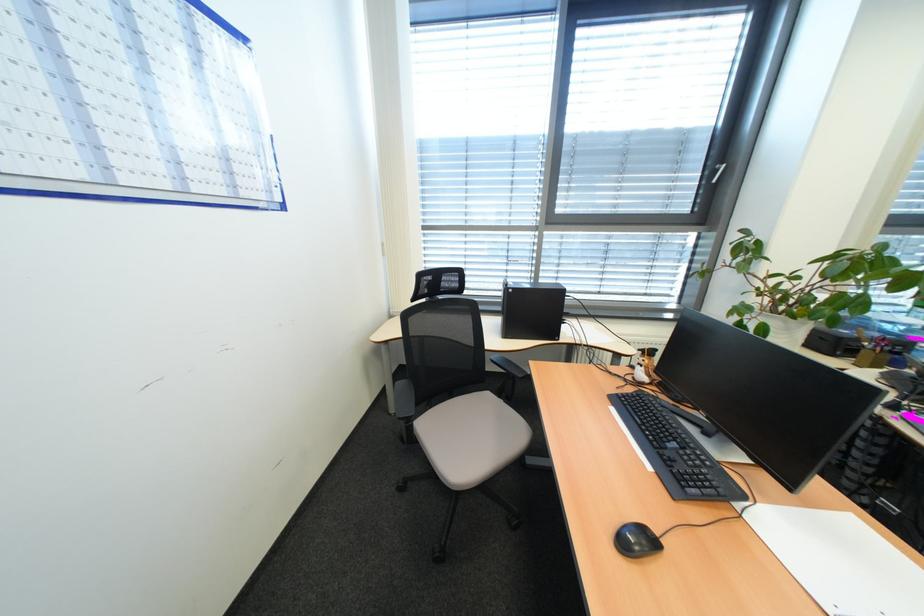
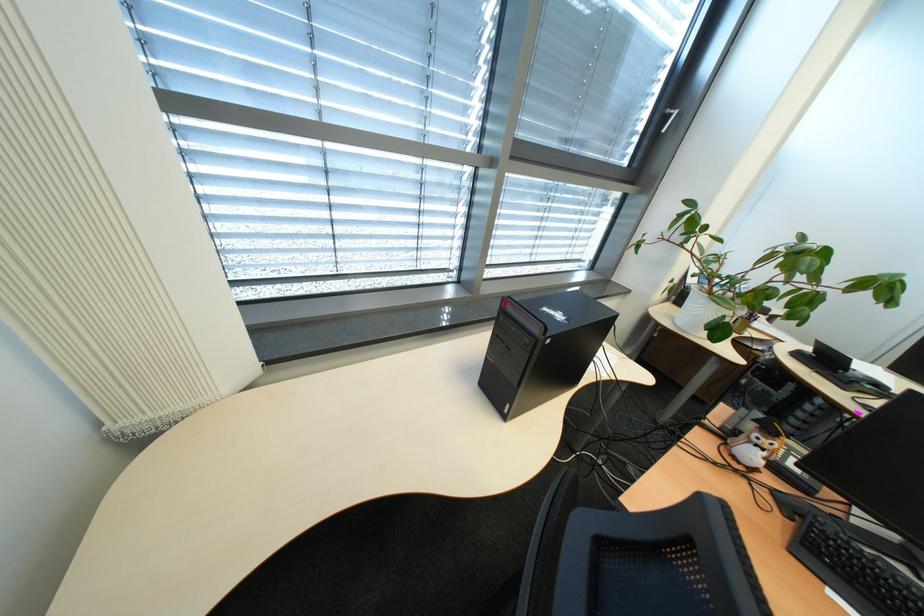
In the second image, find the point that corresponds to point 736,267 in the first image.

(675, 241)